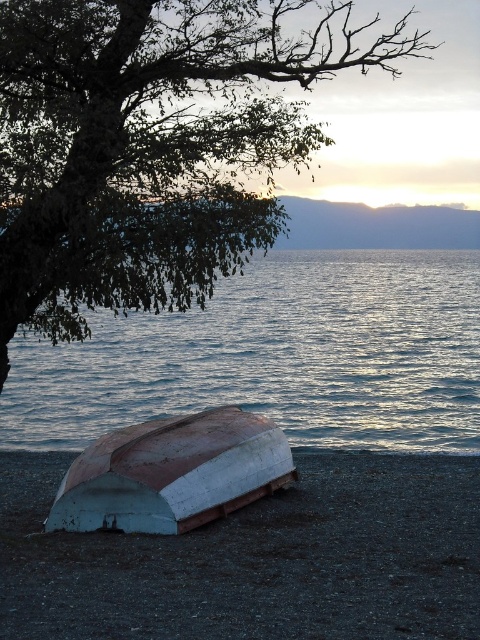
Which of these two, green leafy tree at upper left or blue water at center, stands taller?

With more height is green leafy tree at upper left.

Between point (2, 38) and point (215, 317), which one is positioned in front?

Point (2, 38)

Who is more forward, (x=181, y=260) or (x=16, y=426)?

Positioned in front is point (x=181, y=260).

Locate an element on the screen. The height and width of the screenshot is (640, 480). green leafy tree at upper left is located at coordinates (149, 147).

Who is taller, green leafy tree at upper left or white matte boat at lower left?

green leafy tree at upper left

Is green leafy tree at upper left to the left of white matte boat at lower left from the viewer's perspective?

Incorrect, green leafy tree at upper left is not on the left side of white matte boat at lower left.

Which is in front, point (80, 163) or point (127, 429)?

Positioned in front is point (80, 163).

Locate an element on the screen. This screenshot has height=640, width=480. green leafy tree at upper left is located at coordinates (149, 147).

Is point (169, 392) farther from camera compared to point (139, 486)?

That is True.

Does blue water at center have a lesser height compared to white matte boat at lower left?

In fact, blue water at center may be taller than white matte boat at lower left.

Is point (298, 314) closer to viewer compared to point (205, 449)?

That is False.

Where is `blue water at center`? The height and width of the screenshot is (640, 480). blue water at center is located at coordinates (276, 356).